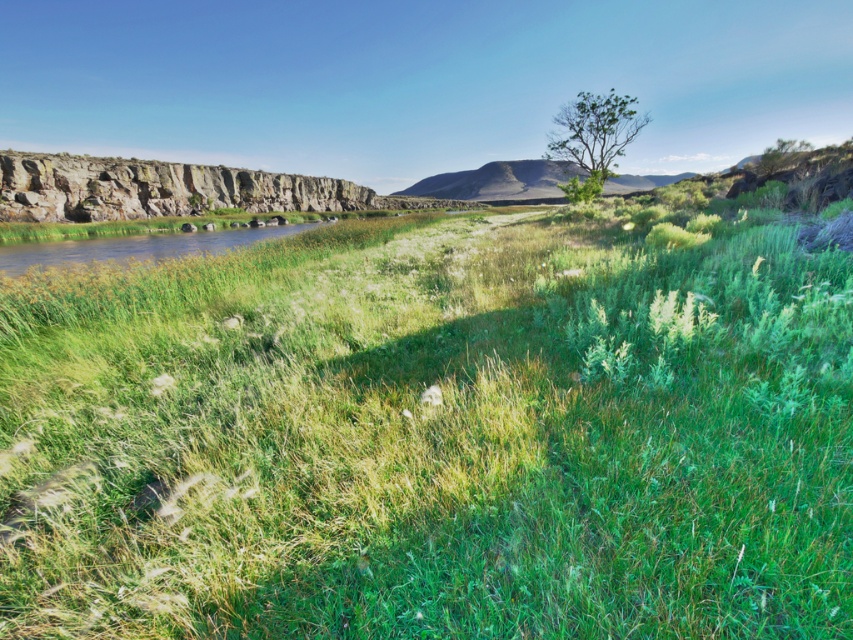
Is the position of rugged stone cliff at left less distant than that of green leafy tree at upper center?

No, it is behind green leafy tree at upper center.

Does point (339, 198) come farther from viewer compared to point (642, 122)?

Yes, it is.

Identify the location of rugged stone cliff at left. The height and width of the screenshot is (640, 853). (155, 188).

Is green grassy at center behind rugged stone cliff at left?

No, it is not.

Between green grassy at center and rugged stone cliff at left, which one appears on the right side from the viewer's perspective?

green grassy at center

Does point (549, 314) come behind point (4, 212)?

No.

This screenshot has width=853, height=640. In order to click on green grassy at center in this screenshot , I will do `click(431, 438)`.

Is green grassy at center closer to the viewer compared to rugged brown hillside at center?

Yes, it is in front of rugged brown hillside at center.

Is point (457, 605) closer to viewer compared to point (524, 163)?

Yes, it is in front of point (524, 163).

What are the coordinates of `green grassy at center` in the screenshot? It's located at (431, 438).